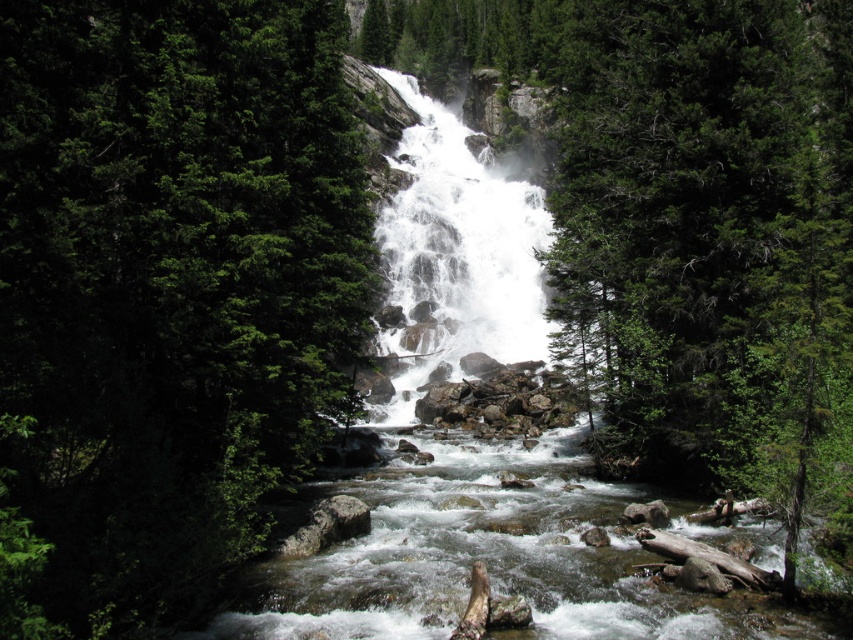
Question: Which point appears farthest from the camera in this image?

Choices:
 (A) (289, 172)
 (B) (793, 180)

Answer: (A)

Question: Which object appears farthest from the camera in this image?

Choices:
 (A) green textured tree at center
 (B) green leafy tree at center

Answer: (A)

Question: Is green leafy tree at center behind green textured tree at center?

Choices:
 (A) no
 (B) yes

Answer: (A)

Question: Does green leafy tree at center appear on the left side of green textured tree at center?

Choices:
 (A) yes
 (B) no

Answer: (A)

Question: Which point appears farthest from the camera in this image?

Choices:
 (A) (737, 262)
 (B) (258, 268)

Answer: (A)

Question: Can you confirm if green leafy tree at center is bigger than green textured tree at center?

Choices:
 (A) no
 (B) yes

Answer: (A)